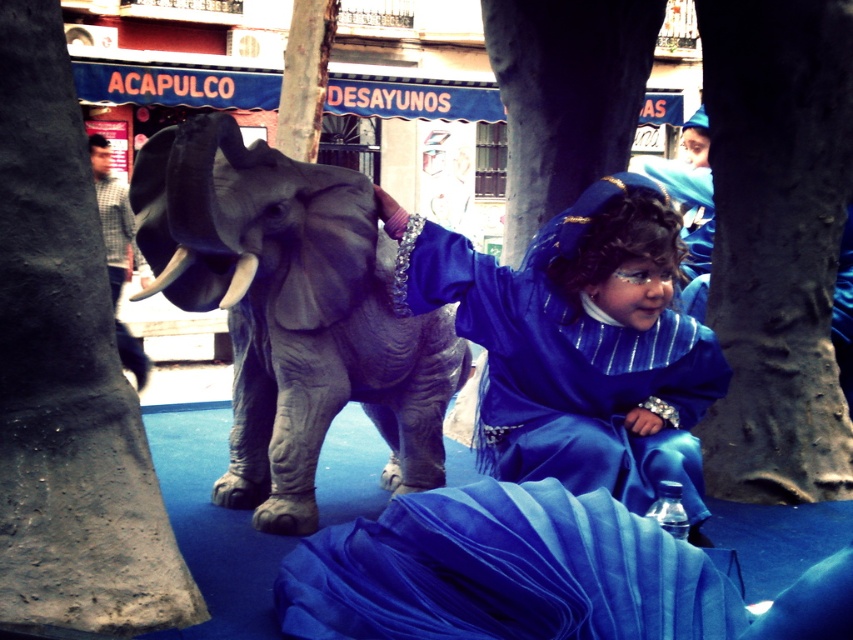
Question: Can you confirm if dark gray bark tree trunk at lower right is wider than matte blue dress at center?

Choices:
 (A) no
 (B) yes

Answer: (A)

Question: Can you confirm if smooth gray tree trunk at left is bigger than smooth bark tree trunk at center?

Choices:
 (A) no
 (B) yes

Answer: (A)

Question: Which point is farther from the camera taking this photo?

Choices:
 (A) tap(305, 97)
 (B) tap(90, 451)

Answer: (A)

Question: Which object is farther from the camera taking this photo?

Choices:
 (A) smooth bark tree trunk at center
 (B) smooth gray tree trunk at left
 (C) smooth gray tree trunk at center
 (D) gray matte elephant at center

Answer: (A)

Question: Can you confirm if dark gray bark tree trunk at lower right is positioned to the right of matte blue dress at center?

Choices:
 (A) no
 (B) yes

Answer: (B)

Question: Which point is farther to the camera?

Choices:
 (A) smooth gray tree trunk at center
 (B) smooth bark tree trunk at center

Answer: (B)